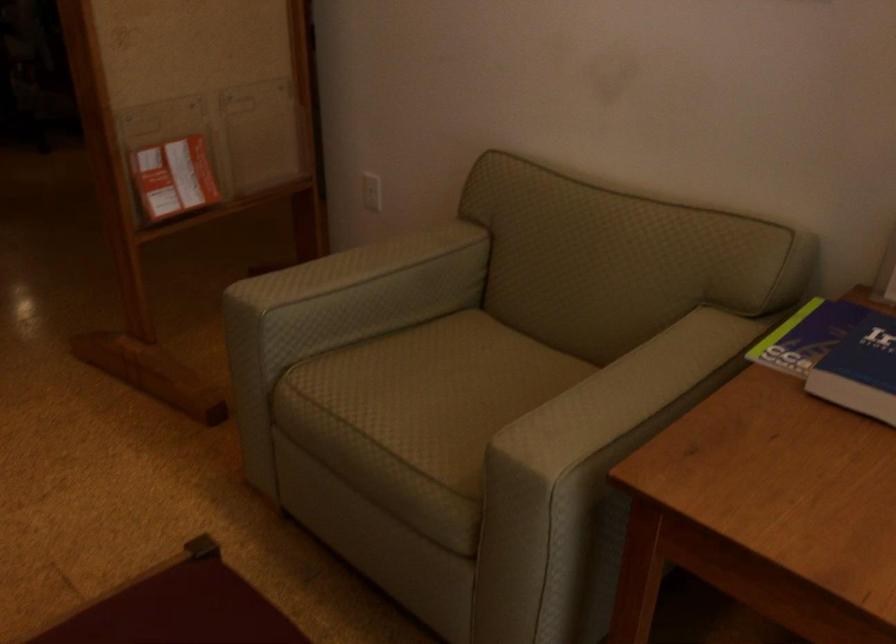
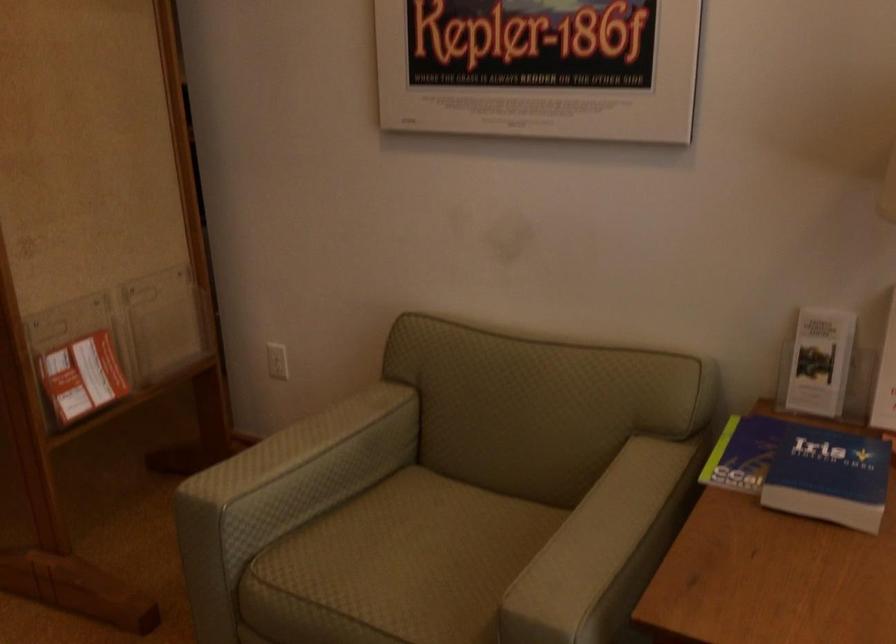
Where in the second image is the point corresponding to (x=634, y=380) from the first image?

(607, 520)